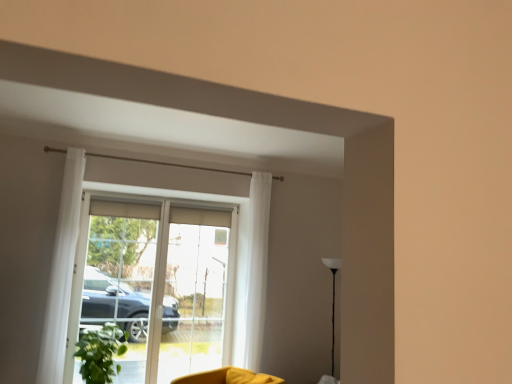
Question: Is translucent glass screen door at center, acting as the first screen door starting from the left, surrounded by transparent glass screen door at center, acting as the 1th screen door starting from the right?

Choices:
 (A) no
 (B) yes

Answer: (A)

Question: From the image's perspective, is transparent glass screen door at center, acting as the 1th screen door starting from the right, above translucent glass screen door at center, which is the second screen door from right to left?

Choices:
 (A) no
 (B) yes

Answer: (A)

Question: Is transparent glass screen door at center, which is counted as the 2th screen door, starting from the left, positioned in front of translucent glass screen door at center, which is the second screen door from right to left?

Choices:
 (A) yes
 (B) no

Answer: (B)

Question: Is transparent glass screen door at center, which is counted as the 2th screen door, starting from the left, oriented towards translucent glass screen door at center, which is the second screen door from right to left?

Choices:
 (A) yes
 (B) no

Answer: (B)

Question: From a real-world perspective, is transparent glass screen door at center, acting as the 1th screen door starting from the right, on translucent glass screen door at center, which is the second screen door from right to left?

Choices:
 (A) no
 (B) yes

Answer: (A)

Question: Can you confirm if transparent glass screen door at center, acting as the 1th screen door starting from the right, is bigger than translucent glass screen door at center, acting as the first screen door starting from the left?

Choices:
 (A) yes
 (B) no

Answer: (A)

Question: Considering the relative positions of white sheer curtain at center, acting as the first curtain starting from the back, and transparent glass door at center in the image provided, is white sheer curtain at center, acting as the first curtain starting from the back, to the right of transparent glass door at center from the viewer's perspective?

Choices:
 (A) no
 (B) yes

Answer: (B)

Question: Is white sheer curtain at center, acting as the first curtain starting from the back, thinner than transparent glass door at center?

Choices:
 (A) no
 (B) yes

Answer: (A)

Question: Is white sheer curtain at center, which is counted as the 2th curtain, starting from the front, beside transparent glass door at center?

Choices:
 (A) yes
 (B) no

Answer: (B)

Question: Does white sheer curtain at center, which is counted as the 2th curtain, starting from the front, lie in front of transparent glass door at center?

Choices:
 (A) yes
 (B) no

Answer: (A)

Question: Can transparent glass door at center be found inside white sheer curtain at center, the 1th curtain positioned from the right?

Choices:
 (A) no
 (B) yes

Answer: (A)

Question: From the image's perspective, is white sheer curtain at center, which is the second curtain in left-to-right order, below transparent glass door at center?

Choices:
 (A) yes
 (B) no

Answer: (B)

Question: Considering the relative sizes of yellow fabric swivel chair at lower center and green matte plant at lower left in the image provided, is yellow fabric swivel chair at lower center wider than green matte plant at lower left?

Choices:
 (A) no
 (B) yes

Answer: (B)